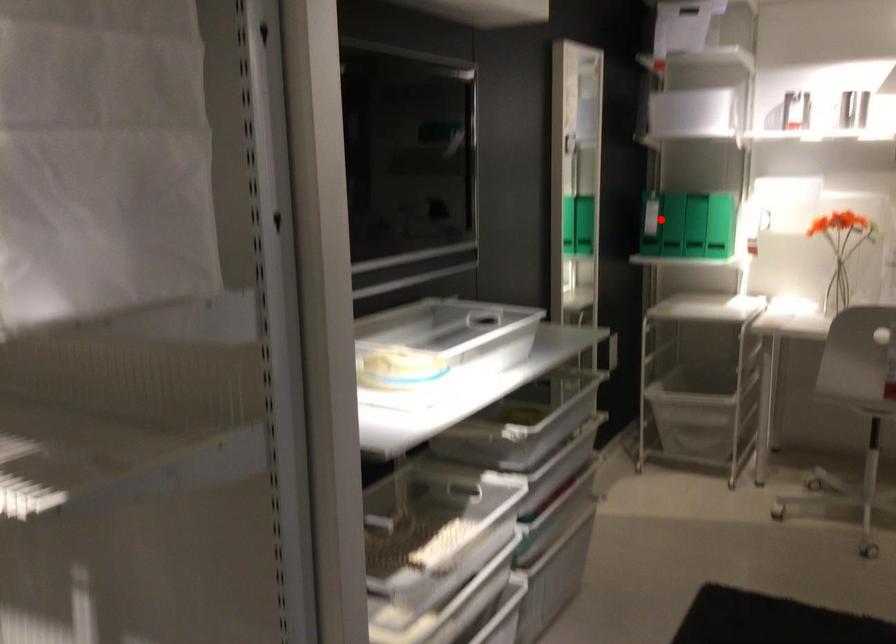
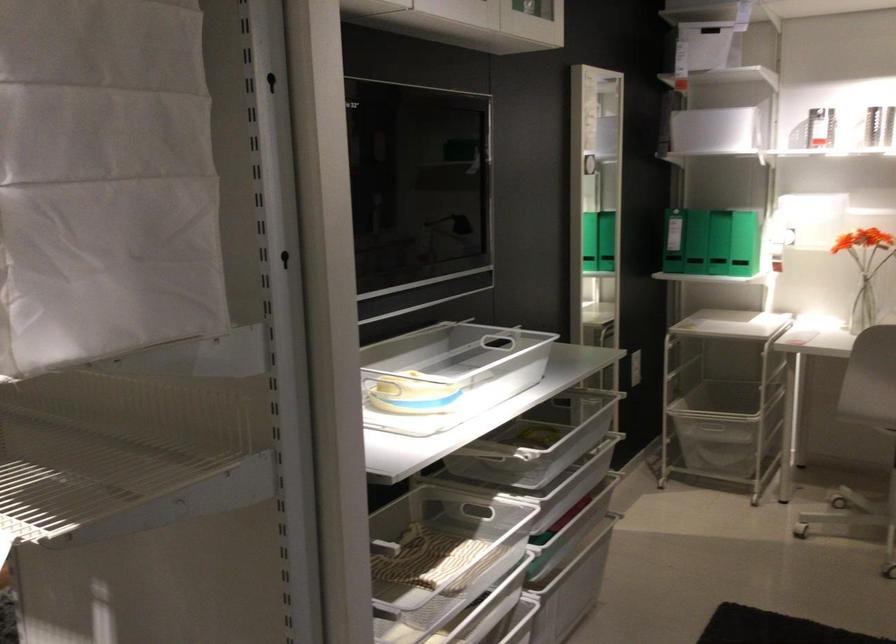
Locate, in the second image, the point that corresponds to the highlighted location in the first image.

(673, 241)